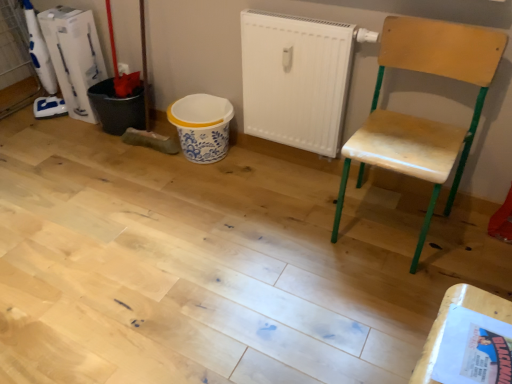
Locate an element on the screen. The width and height of the screenshot is (512, 384). free location in front of wooden chair at right is located at coordinates (387, 296).